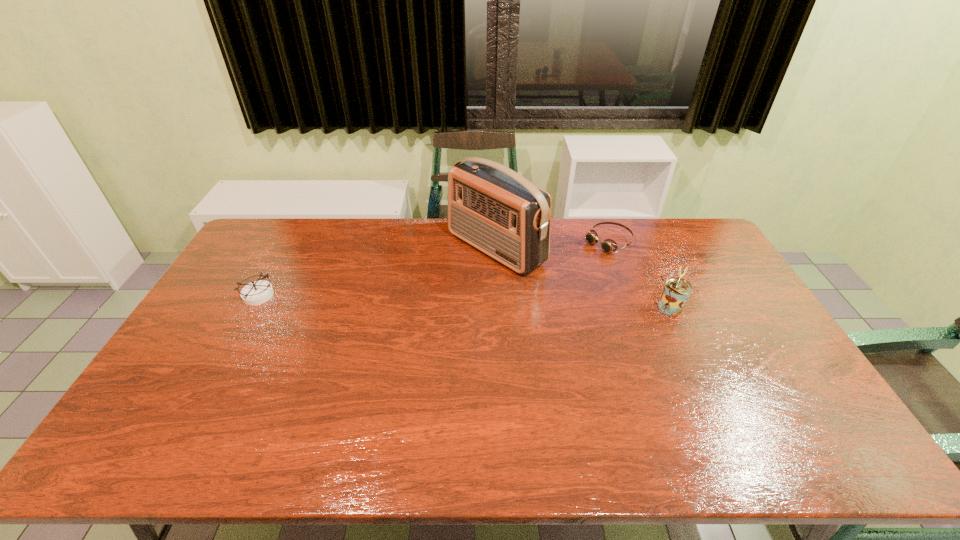
This screenshot has height=540, width=960. Identify the location of blank space located through the lenses of the shortest object. (564, 270).

Locate an element on the screen. The height and width of the screenshot is (540, 960). blank space located 0.280m on the front-facing side of the tallest object is located at coordinates (395, 313).

The width and height of the screenshot is (960, 540). Find the location of `vacant point located on the front-facing side of the tallest object`. vacant point located on the front-facing side of the tallest object is located at coordinates (418, 298).

Locate an element on the screen. free spot located 0.260m on the front-facing side of the tallest object is located at coordinates (400, 309).

Where is `goggles that is at the far edge`? goggles that is at the far edge is located at coordinates (608, 245).

Find the location of a particular element. The height and width of the screenshot is (540, 960). radio receiver present at the far edge is located at coordinates (491, 207).

Identify the location of object located in the left edge section of the desktop. Image resolution: width=960 pixels, height=540 pixels. [258, 292].

In the image, there is a desktop. Identify the location of vacant space at the far edge. (442, 218).

The width and height of the screenshot is (960, 540). Identify the location of vacant space at the near edge of the desktop. (461, 396).

Locate an element on the screen. This screenshot has height=540, width=960. vacant space at the left edge is located at coordinates (241, 325).